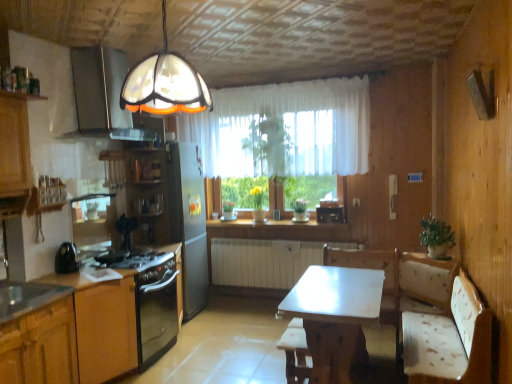
Question: From the image's perspective, is black glossy kettle at left below metallic stainless steel sink at lower left?

Choices:
 (A) yes
 (B) no

Answer: (B)

Question: Is black glossy kettle at left further to camera compared to metallic stainless steel sink at lower left?

Choices:
 (A) no
 (B) yes

Answer: (B)

Question: Is black glossy kettle at left far from metallic stainless steel sink at lower left?

Choices:
 (A) yes
 (B) no

Answer: (B)

Question: From a real-world perspective, is black glossy kettle at left on metallic stainless steel sink at lower left?

Choices:
 (A) no
 (B) yes

Answer: (B)

Question: Considering the relative sizes of black glossy kettle at left and metallic stainless steel sink at lower left in the image provided, is black glossy kettle at left wider than metallic stainless steel sink at lower left?

Choices:
 (A) no
 (B) yes

Answer: (A)

Question: In terms of width, does white glossy countertop at center look wider or thinner when compared to white sheer curtain at center?

Choices:
 (A) wide
 (B) thin

Answer: (A)

Question: From a real-world perspective, is white glossy countertop at center physically located above or below white sheer curtain at center?

Choices:
 (A) above
 (B) below

Answer: (B)

Question: Would you say white glossy countertop at center is inside or outside white sheer curtain at center?

Choices:
 (A) inside
 (B) outside

Answer: (B)

Question: Considering the positions of white glossy countertop at center and white sheer curtain at center in the image, is white glossy countertop at center bigger or smaller than white sheer curtain at center?

Choices:
 (A) big
 (B) small

Answer: (B)

Question: Considering the positions of wooden bar stool at center and translucent glass lampshade at upper center in the image, is wooden bar stool at center taller or shorter than translucent glass lampshade at upper center?

Choices:
 (A) tall
 (B) short

Answer: (B)

Question: Looking at their shapes, would you say wooden bar stool at center is wider or thinner than translucent glass lampshade at upper center?

Choices:
 (A) wide
 (B) thin

Answer: (B)

Question: Relative to translucent glass lampshade at upper center, is wooden bar stool at center in front or behind?

Choices:
 (A) behind
 (B) front

Answer: (A)

Question: Considering the positions of point pyautogui.click(x=294, y=359) and point pyautogui.click(x=159, y=102), is point pyautogui.click(x=294, y=359) closer or farther from the camera than point pyautogui.click(x=159, y=102)?

Choices:
 (A) closer
 (B) farther

Answer: (B)

Question: Based on their sizes in the image, would you say white sheer curtain at center is bigger or smaller than black glossy kettle at left?

Choices:
 (A) small
 (B) big

Answer: (B)

Question: Do you think white sheer curtain at center is within black glossy kettle at left, or outside of it?

Choices:
 (A) outside
 (B) inside

Answer: (A)